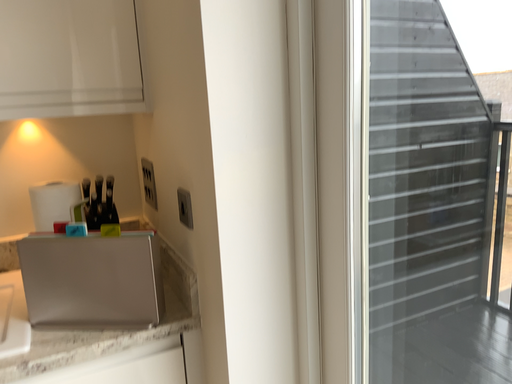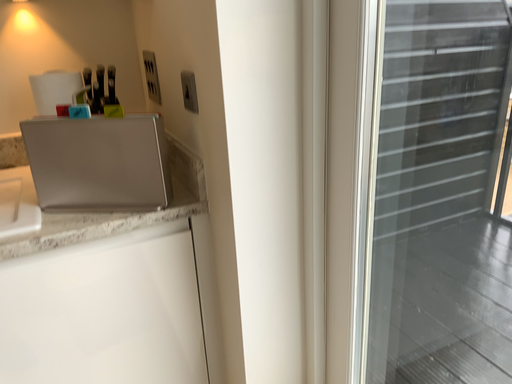
Question: Which way did the camera rotate in the video?

Choices:
 (A) rotated downward
 (B) rotated upward

Answer: (A)